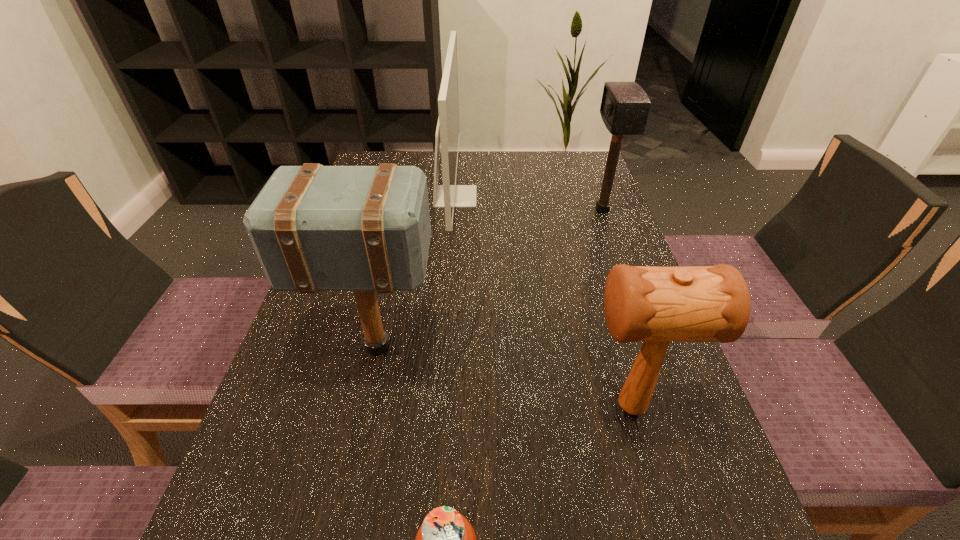
Where is `monitor`? The height and width of the screenshot is (540, 960). monitor is located at coordinates (449, 195).

What are the coordinates of `the leftmost mallet` in the screenshot? It's located at (314, 228).

The image size is (960, 540). Find the location of `the farthest mallet`. the farthest mallet is located at coordinates (625, 106).

Identify the location of vacant point located 0.150m on the front-facing side of the monitor. (530, 197).

The height and width of the screenshot is (540, 960). I want to click on vacant space situated on the striking surface of the leftmost mallet, so click(563, 347).

You are a GUI agent. You are given a task and a screenshot of the screen. Output one action in this format:
    pyautogui.click(x=<x>, y=<y>)
    Task: Click on the vacant position located on the left of the farthest mallet
    The width and height of the screenshot is (960, 540).
    Given the screenshot: What is the action you would take?
    pyautogui.click(x=458, y=210)

Locate an element on the screen. object at the far edge is located at coordinates (449, 195).

You are a GUI agent. You are given a task and a screenshot of the screen. Output one action in this format:
    pyautogui.click(x=<x>, y=<y>)
    Task: Click on the object located at the left edge
    Image resolution: width=960 pixels, height=540 pixels.
    Given the screenshot: What is the action you would take?
    pyautogui.click(x=314, y=228)

You are a GUI agent. You are given a task and a screenshot of the screen. Output one action in this format:
    pyautogui.click(x=<x>, y=<y>)
    Task: Click on the free space at the far edge of the desktop
    The height and width of the screenshot is (540, 960).
    Given the screenshot: What is the action you would take?
    pyautogui.click(x=470, y=162)

Where is `vacant area at the left edge`? vacant area at the left edge is located at coordinates (318, 306).